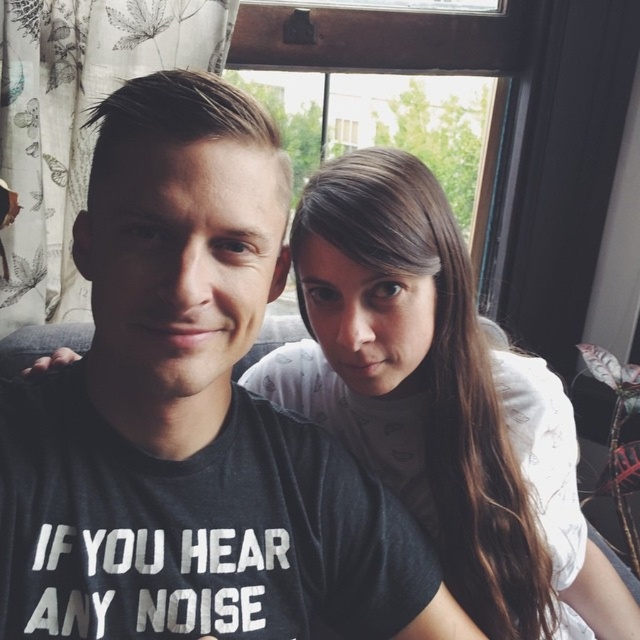
Between matte black t-shirt at center and white matte shirt at upper right, which one appears on the left side from the viewer's perspective?

Positioned to the left is matte black t-shirt at center.

Is the position of matte black t-shirt at center less distant than that of white matte shirt at upper right?

Yes.

Does point (268, 138) come farther from viewer compared to point (492, 556)?

No.

The height and width of the screenshot is (640, 640). What are the coordinates of `matte black t-shirt at center` in the screenshot? It's located at (204, 368).